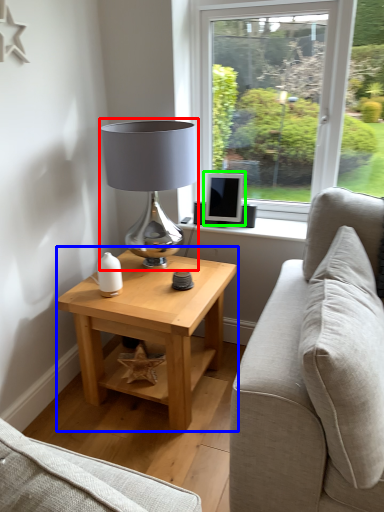
Question: Based on their relative distances, which object is farther from table lamp (highlighted by a red box)? Choose from table (highlighted by a blue box) and computer monitor (highlighted by a green box).

Choices:
 (A) table
 (B) computer monitor

Answer: (A)